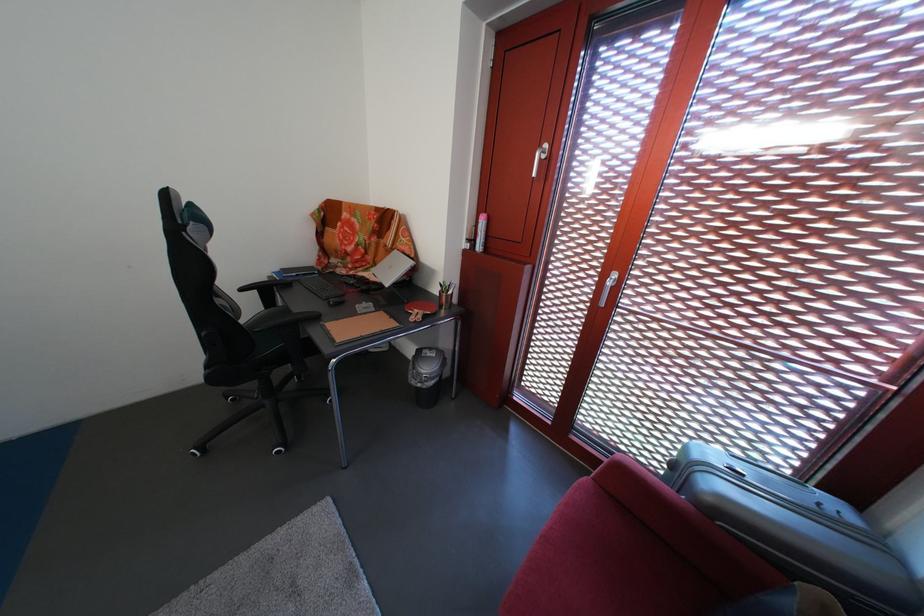
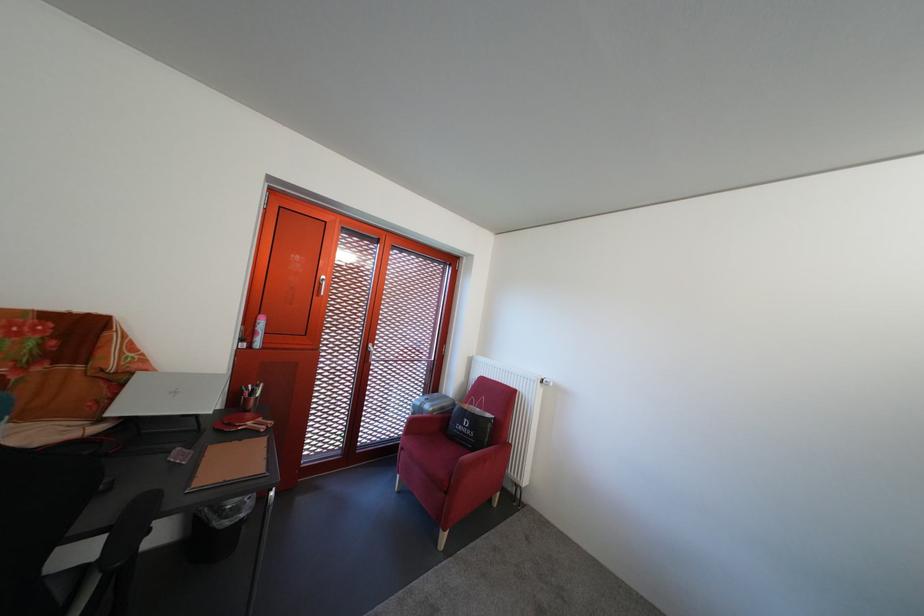
Locate, in the second image, the point that corresponds to point 424,389 in the first image.

(237, 530)